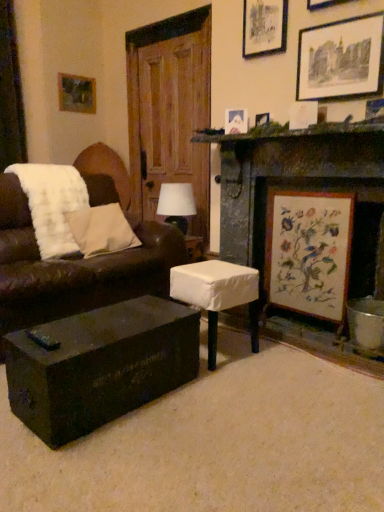
Question: Is matte black trunk at lower center positioned in front of matte white picture frame at upper right, which ranks as the 4th picture frame in back-to-front order?

Choices:
 (A) no
 (B) yes

Answer: (B)

Question: From the image's perspective, would you say matte black trunk at lower center is positioned over matte white picture frame at upper right, which ranks as the 4th picture frame in left-to-right order?

Choices:
 (A) no
 (B) yes

Answer: (A)

Question: Is matte black trunk at lower center facing away from matte white picture frame at upper right, which is counted as the 5th picture frame, starting from the top?

Choices:
 (A) no
 (B) yes

Answer: (A)

Question: From a real-world perspective, is matte black trunk at lower center positioned over matte white picture frame at upper right, the 2th picture frame positioned from the bottom, based on gravity?

Choices:
 (A) no
 (B) yes

Answer: (A)

Question: Does matte black trunk at lower center appear on the left side of matte white picture frame at upper right, which ranks as the third picture frame in right-to-left order?

Choices:
 (A) no
 (B) yes

Answer: (B)

Question: In terms of width, does matte black trunk at lower center look wider or thinner when compared to green mossy stone mantle at upper right?

Choices:
 (A) wide
 (B) thin

Answer: (A)

Question: Considering the positions of point tap(162, 301) and point tap(312, 134), is point tap(162, 301) closer or farther from the camera than point tap(312, 134)?

Choices:
 (A) farther
 (B) closer

Answer: (B)

Question: In the image, is matte black trunk at lower center on the left side or the right side of green mossy stone mantle at upper right?

Choices:
 (A) right
 (B) left

Answer: (B)

Question: Is matte black trunk at lower center situated inside green mossy stone mantle at upper right or outside?

Choices:
 (A) inside
 (B) outside

Answer: (B)

Question: Considering the relative positions of green mossy stone mantle at upper right and matte white picture frame at upper center, which is the fourth picture frame in top-to-bottom order, in the image provided, is green mossy stone mantle at upper right to the left or to the right of matte white picture frame at upper center, which is the fourth picture frame in top-to-bottom order,?

Choices:
 (A) right
 (B) left

Answer: (A)

Question: From a real-world perspective, is green mossy stone mantle at upper right above or below matte white picture frame at upper center, which ranks as the second picture frame in back-to-front order?

Choices:
 (A) above
 (B) below

Answer: (B)

Question: Is point (274, 122) positioned closer to the camera than point (231, 122)?

Choices:
 (A) closer
 (B) farther

Answer: (B)

Question: In terms of height, does green mossy stone mantle at upper right look taller or shorter compared to matte white picture frame at upper center, the 5th picture frame from the front?

Choices:
 (A) tall
 (B) short

Answer: (B)

Question: From their relative heights in the image, would you say white fabric-covered stool at center is taller or shorter than white fluffy pillow at left?

Choices:
 (A) tall
 (B) short

Answer: (A)

Question: Looking at their shapes, would you say white fabric-covered stool at center is wider or thinner than white fluffy pillow at left?

Choices:
 (A) wide
 (B) thin

Answer: (A)